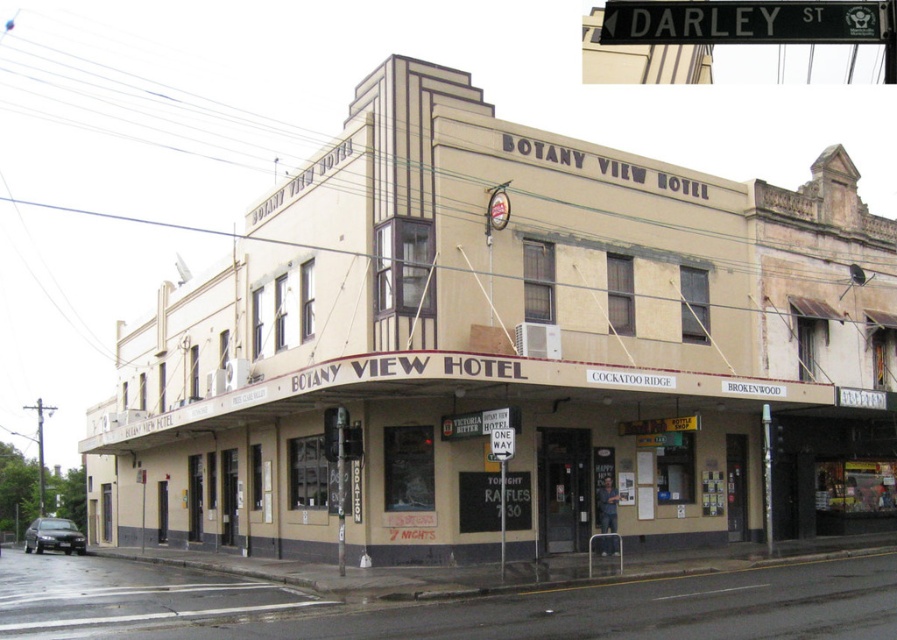
Can you confirm if beige textured building at center is taller than black metal street sign at upper center?

Indeed, beige textured building at center has a greater height compared to black metal street sign at upper center.

Identify the location of beige textured building at center. This screenshot has height=640, width=897. (509, 349).

Is point (828, 481) farther from camera compared to point (846, 13)?

That is True.

Image resolution: width=897 pixels, height=640 pixels. In order to click on beige textured building at center in this screenshot , I will do `click(509, 349)`.